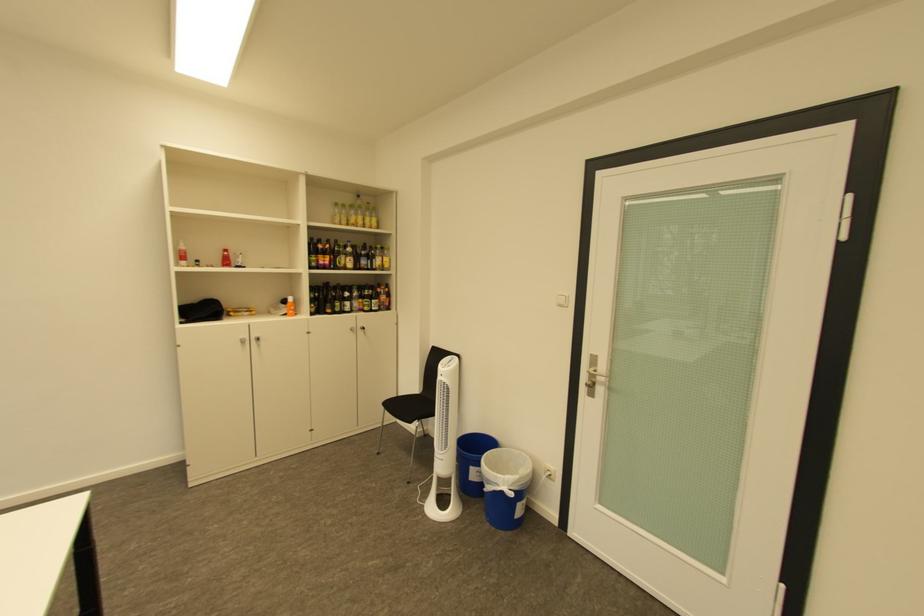
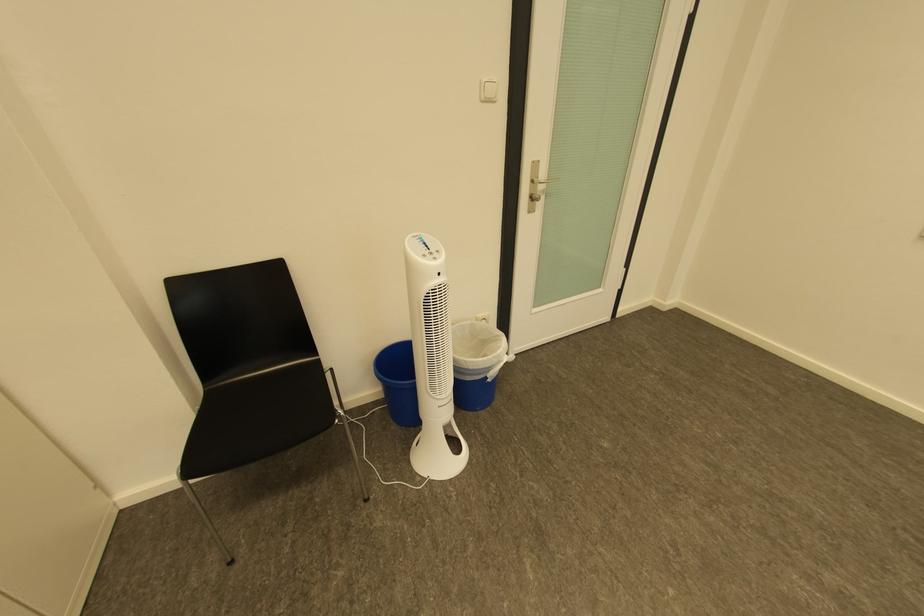
The point at (499,483) is marked in the first image. Where is the corresponding point in the second image?

(499, 370)